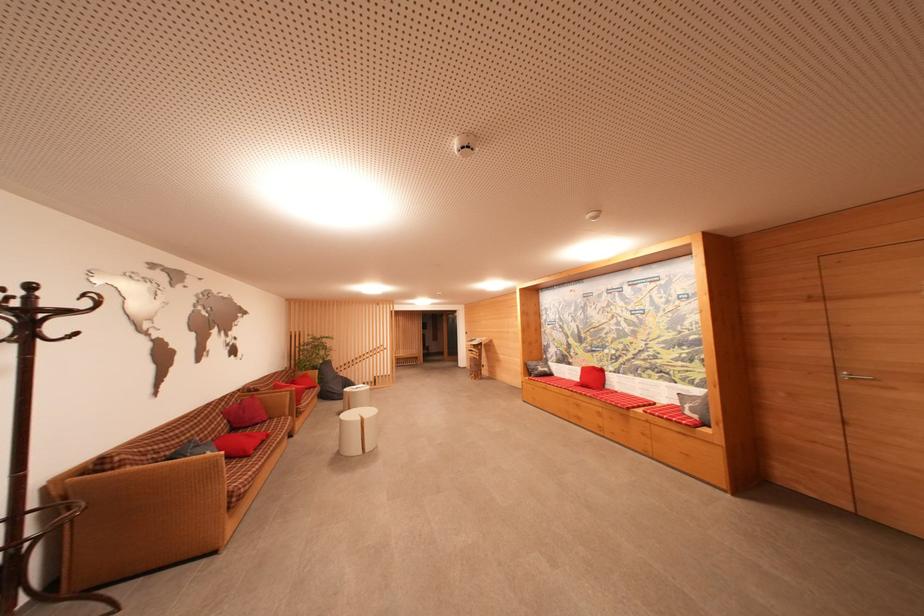
This screenshot has height=616, width=924. I want to click on silver door handle, so click(861, 376).